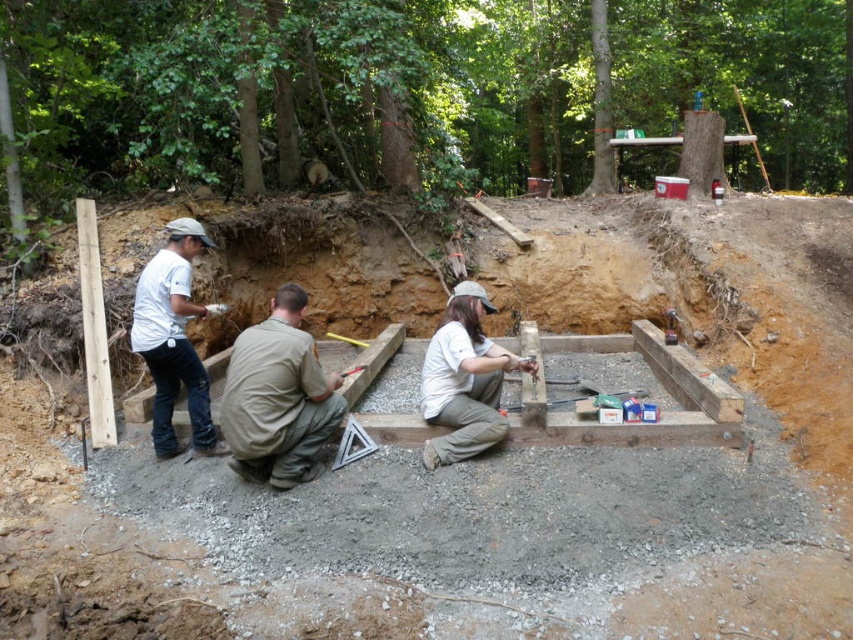
Is brown uniform at center smaller than white cotton shirt at center?

Actually, brown uniform at center might be larger than white cotton shirt at center.

Is brown uniform at center behind white cotton shirt at center?

No, brown uniform at center is closer to the viewer.

The height and width of the screenshot is (640, 853). Identify the location of brown uniform at center. (277, 397).

Does brown uniform at center lie in front of white matte shirt at left?

Yes, it is in front of white matte shirt at left.

Who is taller, brown uniform at center or white matte shirt at left?

white matte shirt at left is taller.

Consider the image. Who is more distant from viewer, (331, 374) or (194, 237)?

The point (331, 374) is more distant.

Identify the location of brown uniform at center. (277, 397).

Between white matte shirt at left and white cotton shirt at center, which one has less height?

white cotton shirt at center

Does white matte shirt at left appear on the left side of white cotton shirt at center?

Indeed, white matte shirt at left is positioned on the left side of white cotton shirt at center.

Is point (178, 296) behind point (426, 461)?

Yes, point (178, 296) is farther from viewer.

Image resolution: width=853 pixels, height=640 pixels. Identify the location of white matte shirt at left. (173, 339).